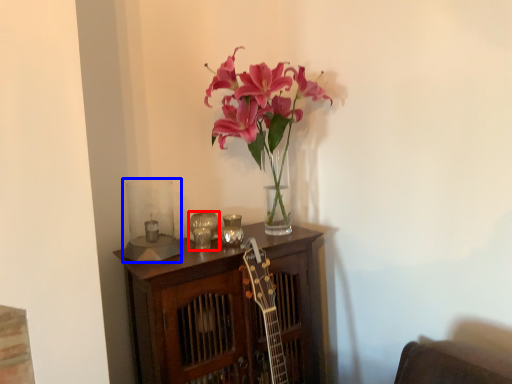
Question: Which object is closer to the camera taking this photo, candle holder (highlighted by a red box) or candle holder (highlighted by a blue box)?

Choices:
 (A) candle holder
 (B) candle holder

Answer: (B)